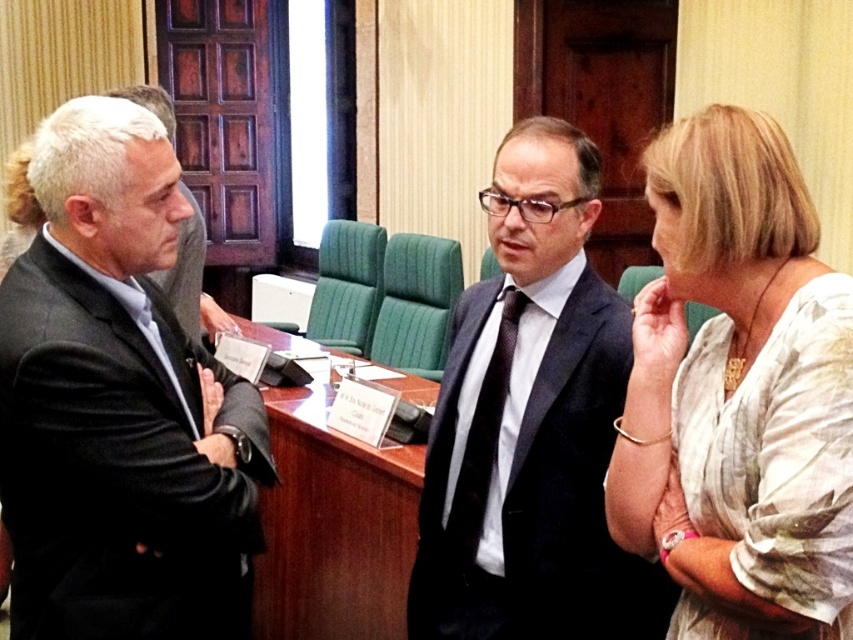
You are a photographer standing in the conference room and want to take a closeup photo of the white textured blouse at center without moving any objects. Can you get a closeup shot of it from where you are standing?

The white textured blouse at center is 4.42 feet away from viewer, so yes, you can take a closeup photo of the white textured blouse at center from your current position since most cameras can focus clearly at that distance.

You are an event planner arranging seating for a formal dinner. You need to place a name tag on the table in front of each guest. The name tag must be placed directly in front of the dark gray suit at left and the black dotted tie at center. Which guest should have their name tag placed higher on the table?

The dark gray suit at left should have its name tag placed higher on the table because it is located above the black dotted tie at center.